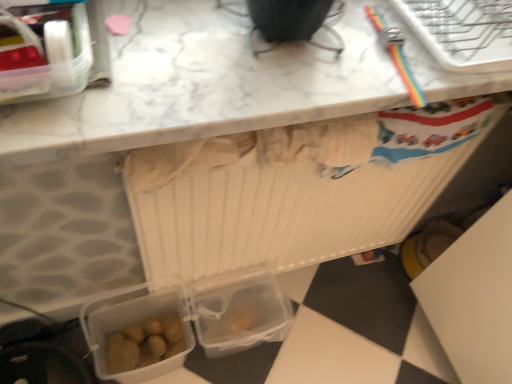
Question: Is white marble countertop at upper center completely or partially inside transparent plastic lunch box at lower center, which is the second lunch box in top-to-bottom order?

Choices:
 (A) no
 (B) yes

Answer: (A)

Question: Considering the relative sizes of transparent plastic lunch box at lower center, positioned as the 2th lunch box in bottom-to-top order, and white marble countertop at upper center in the image provided, is transparent plastic lunch box at lower center, positioned as the 2th lunch box in bottom-to-top order, wider than white marble countertop at upper center?

Choices:
 (A) no
 (B) yes

Answer: (A)

Question: Is transparent plastic lunch box at lower center, arranged as the first lunch box when viewed from the back, outside of white marble countertop at upper center?

Choices:
 (A) yes
 (B) no

Answer: (A)

Question: Considering the relative positions of transparent plastic lunch box at lower center, which is the second lunch box in top-to-bottom order, and white marble countertop at upper center in the image provided, is transparent plastic lunch box at lower center, which is the second lunch box in top-to-bottom order, behind white marble countertop at upper center?

Choices:
 (A) yes
 (B) no

Answer: (A)

Question: Is transparent plastic lunch box at lower center, placed as the third lunch box when sorted from front to back, to the left of white marble countertop at upper center from the viewer's perspective?

Choices:
 (A) yes
 (B) no

Answer: (A)

Question: Is translucent plastic lunch box at lower left, the 2th lunch box positioned from the front, not within white marble countertop at upper center?

Choices:
 (A) yes
 (B) no

Answer: (A)

Question: Is white marble countertop at upper center completely or partially inside translucent plastic lunch box at lower left, the 2th lunch box positioned from the front?

Choices:
 (A) no
 (B) yes

Answer: (A)

Question: From a real-world perspective, is translucent plastic lunch box at lower left, the 2th lunch box when ordered from back to front, below white marble countertop at upper center?

Choices:
 (A) no
 (B) yes

Answer: (B)

Question: Would you consider translucent plastic lunch box at lower left, the 2th lunch box when ordered from back to front, to be distant from white marble countertop at upper center?

Choices:
 (A) no
 (B) yes

Answer: (A)

Question: From the image's perspective, is translucent plastic lunch box at lower left, the 2th lunch box when ordered from back to front, on white marble countertop at upper center?

Choices:
 (A) no
 (B) yes

Answer: (A)

Question: Is translucent plastic lunch box at lower left, the first lunch box positioned from the bottom, oriented away from white marble countertop at upper center?

Choices:
 (A) no
 (B) yes

Answer: (A)

Question: From the image's perspective, is rainbow plastic bracelet at upper right on top of translucent plastic lunch box at lower left, the first lunch box positioned from the bottom?

Choices:
 (A) no
 (B) yes

Answer: (B)